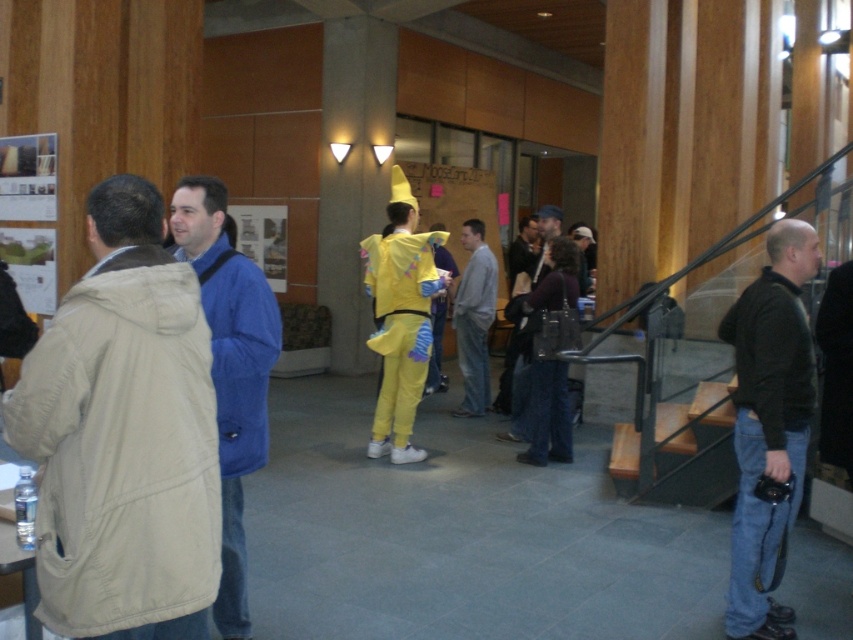
You are a delivery person carrying a package that requires a 5 meter minimum distance to avoid damaging its contents. You need to move past the blue fabric jacket at center and the gray cotton sweatshirt at center. Can you safely pass between them without causing damage?

The blue fabric jacket at center and the gray cotton sweatshirt at center are 4.91 meters apart. Since the required minimum distance is 5 meters, the gap between them is slightly too narrow, so you cannot safely pass between them without risking damage to the package.

You are standing in the lobby and want to reach the point marked as point (167, 636). If your walking speed is 3 feet per second, how many seconds will it take you to reach that point?

The distance between you and point (167, 636) is 7.78 feet. At a speed of 3 feet per second, it would take approximately 2.59 seconds to reach the point.

Based on the photo, you are standing in the lobby and need to locate the beige fabric jacket at left and the wooden at right. Which object is positioned higher from the ground?

The beige fabric jacket at left is located above wooden at right, meaning it is higher from the ground than the wooden at right.